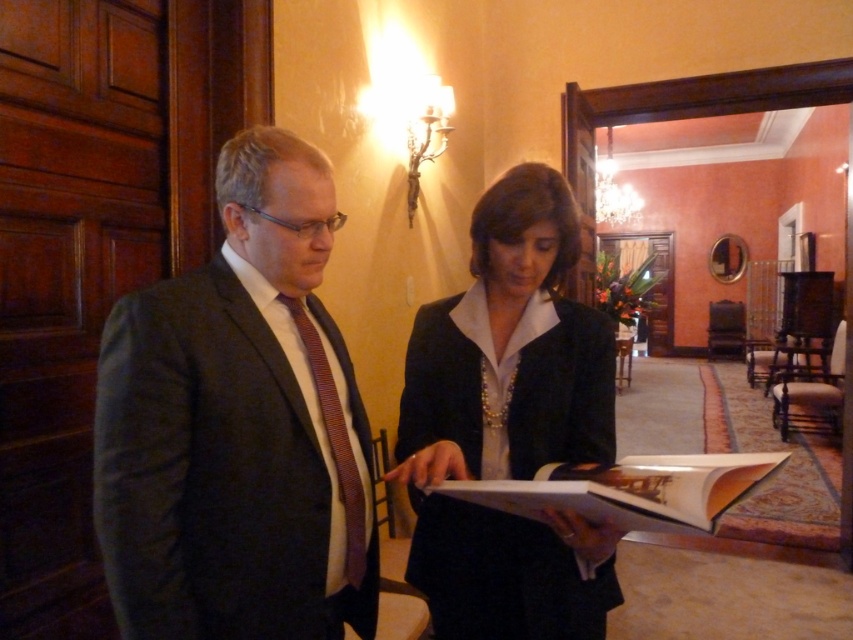
Looking at this image, you are an assistant who needs to hand a document to the person on the left. The document must be placed on the object closer to you. Which object should you choose between the white paper book at center and the striped silk tie at left?

The white paper book at center is closer to the viewer than the striped silk tie at left, so you should place the document on the white paper book at center.